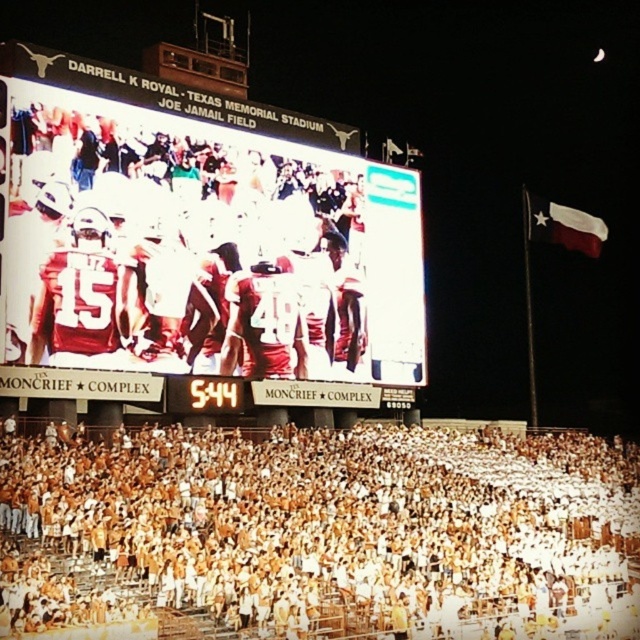
You are a photographer trying to capture a wide shot of the stadium. You notice the white digital scoreboard at upper center and the white fabric flag at upper right. Which object should you focus on first to ensure both are in frame without cropping?

Focus on the white digital scoreboard at upper center first since it is wider than the white fabric flag at upper right, ensuring there is enough space for both in the frame.

You are standing at the point marked as point [372,218] in the stadium. You want to take a photo of the scoreboard. Is the scoreboard within your camera lens range, which can capture objects up to 100 meters away?

The distance between you and the scoreboard is 75.11 meters, which is within the camera lens range of 100 meters. Therefore, the scoreboard is within your camera lens range.